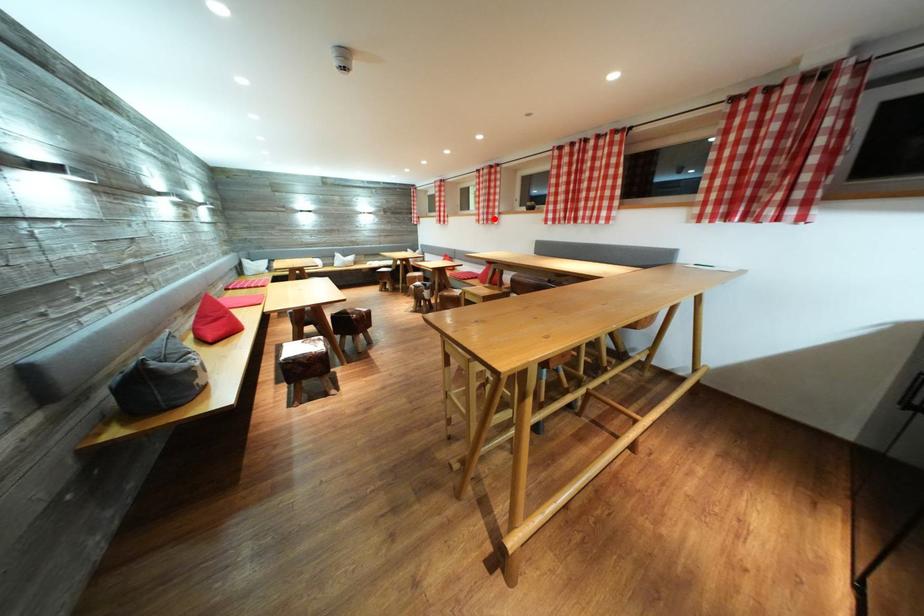
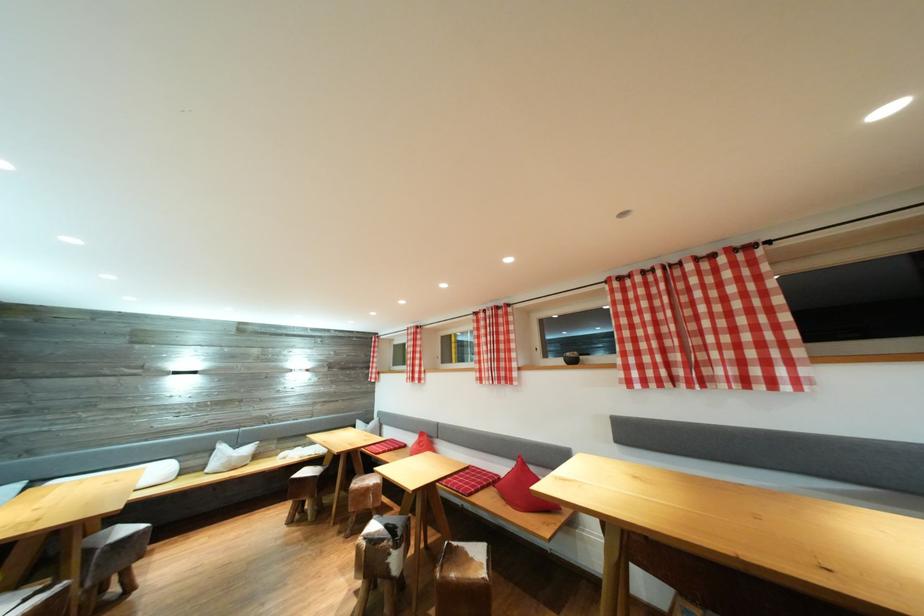
Question: A red point is marked in image1. In image2, is the corresponding 3D point closer to the camera or farther? Reply with the corresponding letter.

Choices:
 (A) The corresponding 3D point is closer.
 (B) The corresponding 3D point is farther.

Answer: (B)